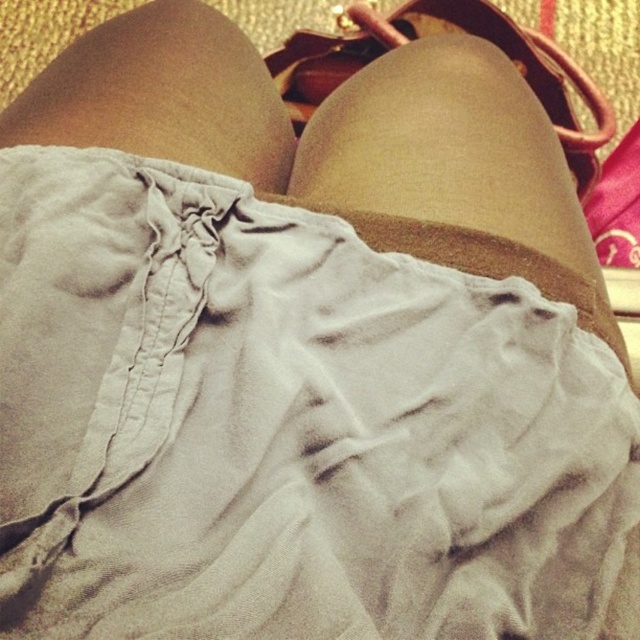
Question: Is matte beige shorts at center wider than matte brown shoe at upper center?

Choices:
 (A) yes
 (B) no

Answer: (B)

Question: Is matte beige shorts at center in front of matte brown shoe at upper center?

Choices:
 (A) no
 (B) yes

Answer: (B)

Question: Which object appears closest to the camera in this image?

Choices:
 (A) matte brown shoe at upper center
 (B) matte beige shorts at center

Answer: (B)

Question: Can you confirm if matte beige shorts at center is positioned above matte brown shoe at upper center?

Choices:
 (A) yes
 (B) no

Answer: (B)